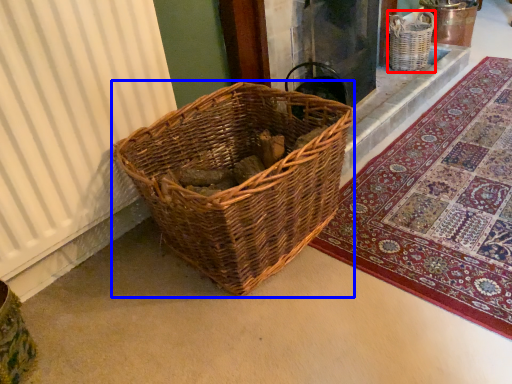
Question: Among these objects, which one is farthest to the camera, basket (highlighted by a red box) or picnic basket (highlighted by a blue box)?

Choices:
 (A) basket
 (B) picnic basket

Answer: (A)